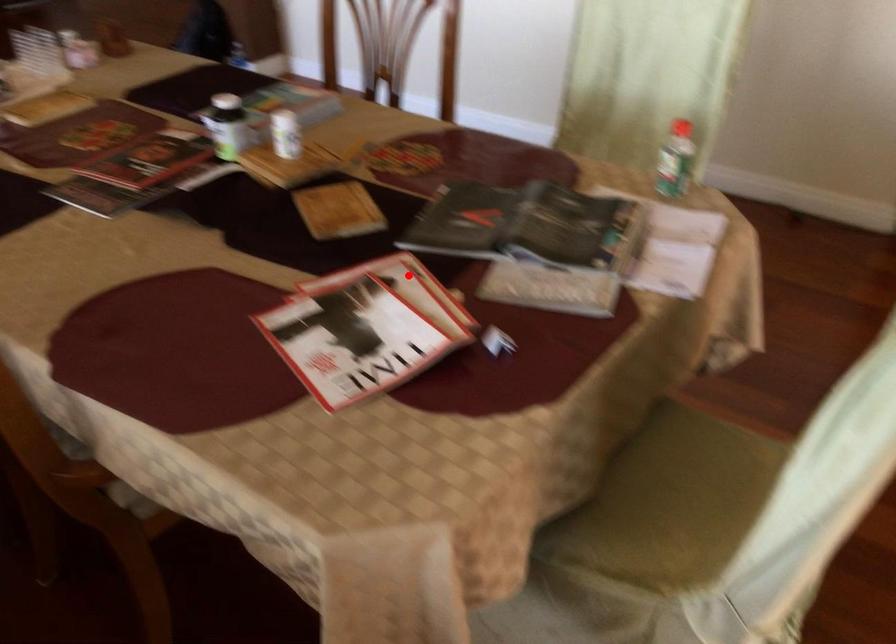
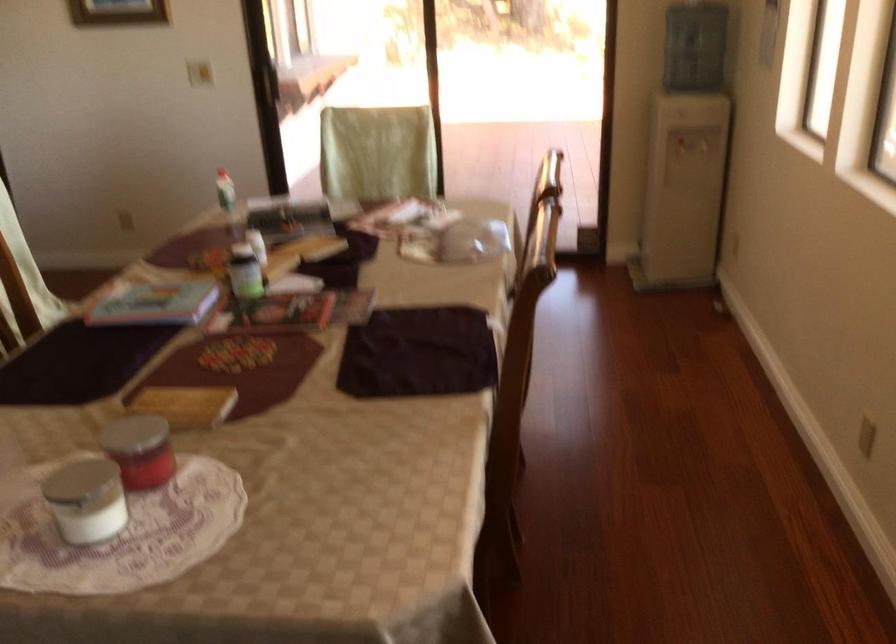
Find the pixel in the second image that matches the highlighted location in the first image.

(366, 218)